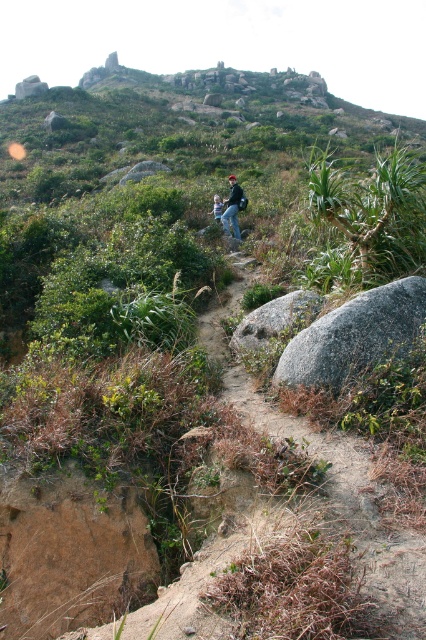
Question: Which is nearer to the gray granite rock at center?

Choices:
 (A) dirt path at center
 (B) blue denim jeans at center

Answer: (A)

Question: Does dirt path at center have a larger size compared to gray rough rock at center?

Choices:
 (A) no
 (B) yes

Answer: (B)

Question: Observing the image, what is the correct spatial positioning of blue jeans at center in reference to blue denim jeans at center?

Choices:
 (A) above
 (B) below

Answer: (B)

Question: Which point is closer to the camera taking this photo?

Choices:
 (A) (218, 216)
 (B) (310, 342)
 (C) (259, 531)
 (D) (235, 182)

Answer: (C)

Question: Which point appears closest to the camera in this image?

Choices:
 (A) (232, 220)
 (B) (258, 308)
 (C) (325, 360)
 (D) (340, 592)

Answer: (D)

Question: Does gray granite rock at center have a lesser width compared to blue denim jeans at center?

Choices:
 (A) no
 (B) yes

Answer: (A)